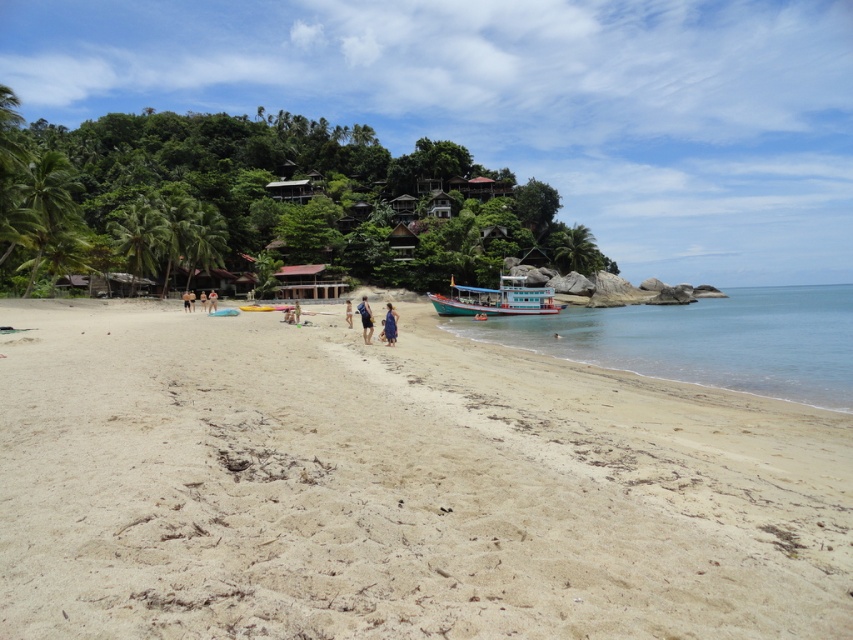
You are standing on the beach and want to take a photo of both the clear blue water at lower right and the teal wooden boat at center. Which object should you zoom in on to ensure both fit in the frame?

Since the clear blue water at lower right is larger than the teal wooden boat at center, you should zoom out to include both objects in the frame.

You are standing on the beige sandy beach at center and want to reach the blue fabric person at center. In which direction should you walk to get closer to them?

The beige sandy beach at center is positioned on the right side of blue fabric person at center, so you should walk to the left to get closer to them.